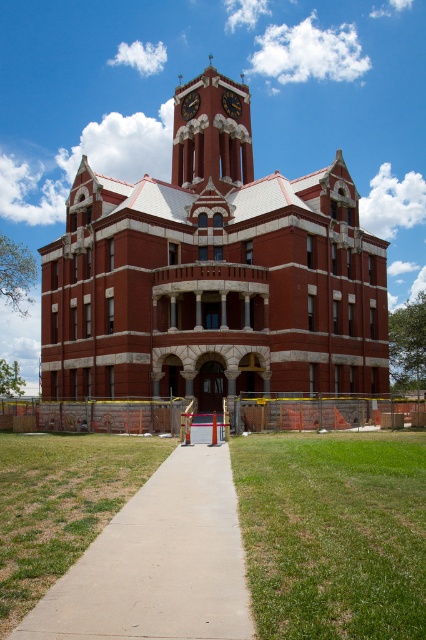
You are an architect designing a new building that needs to incorporate two red brick structures. The first is the red brick tower at center, and the second is the matte red brick clock tower at upper center. Based on the image, which structure should you prioritize in terms of height to maintain historical accuracy?

The red brick tower at center should be prioritized for greater height compared to the matte red brick clock tower at upper center to maintain historical accuracy.

You are standing at the center of the image. Which direction should you look to see the red brick tower at center?

The red brick tower at center is located at the center of the image, so you should look straight ahead to see it.